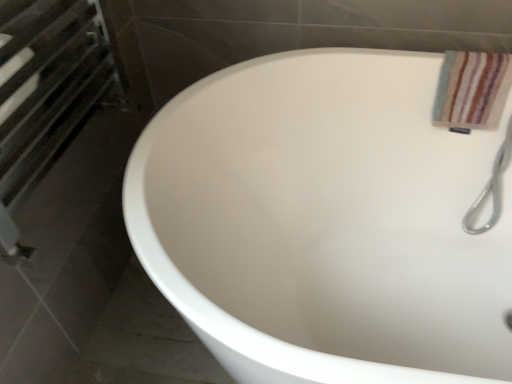
Question: Is matte metal towel rack at left bigger or smaller than white glossy bathtub at center?

Choices:
 (A) small
 (B) big

Answer: (A)

Question: From a real-world perspective, is matte metal towel rack at left positioned above or below white glossy bathtub at center?

Choices:
 (A) above
 (B) below

Answer: (A)

Question: Which is farther from the white glossy bathtub at center?

Choices:
 (A) matte metal towel rack at left
 (B) striped cotton towel at upper right

Answer: (A)

Question: Which of these objects is positioned closest to the white glossy bathtub at center?

Choices:
 (A) matte metal towel rack at left
 (B) striped cotton towel at upper right

Answer: (B)